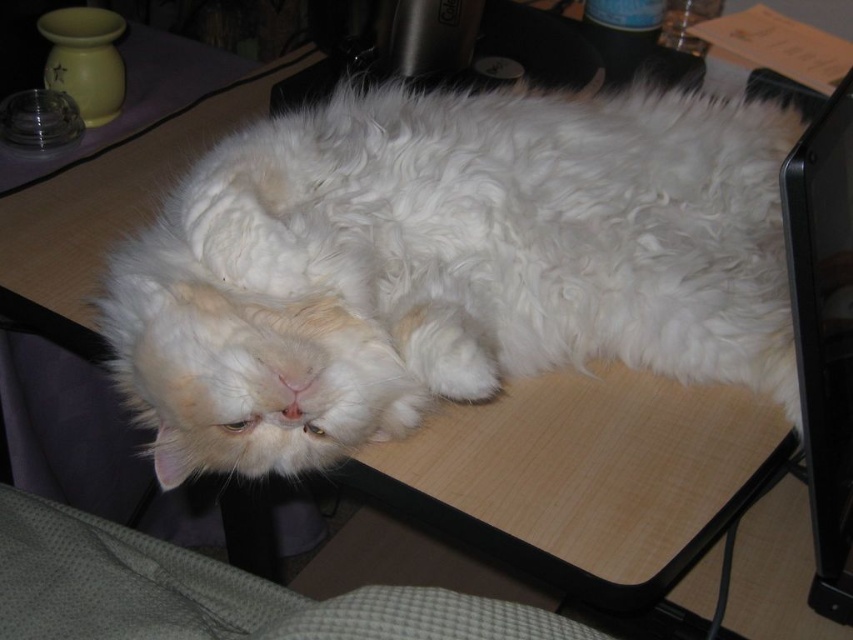
Question: Can you confirm if white fluffy cat at center is bigger than black glossy monitor at right?

Choices:
 (A) yes
 (B) no

Answer: (A)

Question: Among these points, which one is nearest to the camera?

Choices:
 (A) (633, 161)
 (B) (822, 580)

Answer: (B)

Question: Which of the following is the closest to the observer?

Choices:
 (A) (647, 147)
 (B) (851, 349)

Answer: (B)

Question: Considering the relative positions of white fluffy cat at center and black glossy monitor at right in the image provided, where is white fluffy cat at center located with respect to black glossy monitor at right?

Choices:
 (A) left
 (B) right

Answer: (A)

Question: Among these objects, which one is nearest to the camera?

Choices:
 (A) white fluffy cat at center
 (B) black glossy monitor at right

Answer: (B)

Question: Is white fluffy cat at center positioned in front of black glossy monitor at right?

Choices:
 (A) no
 (B) yes

Answer: (A)